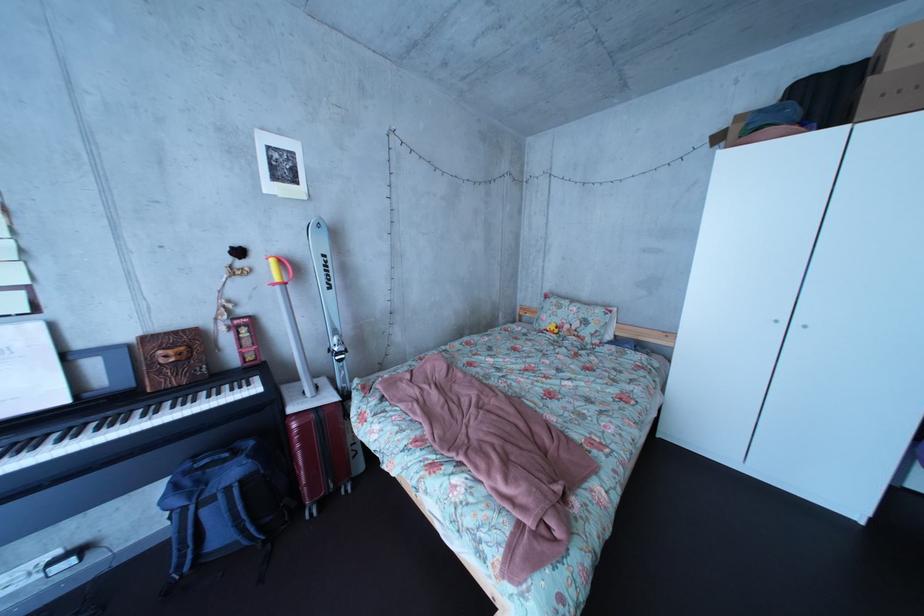
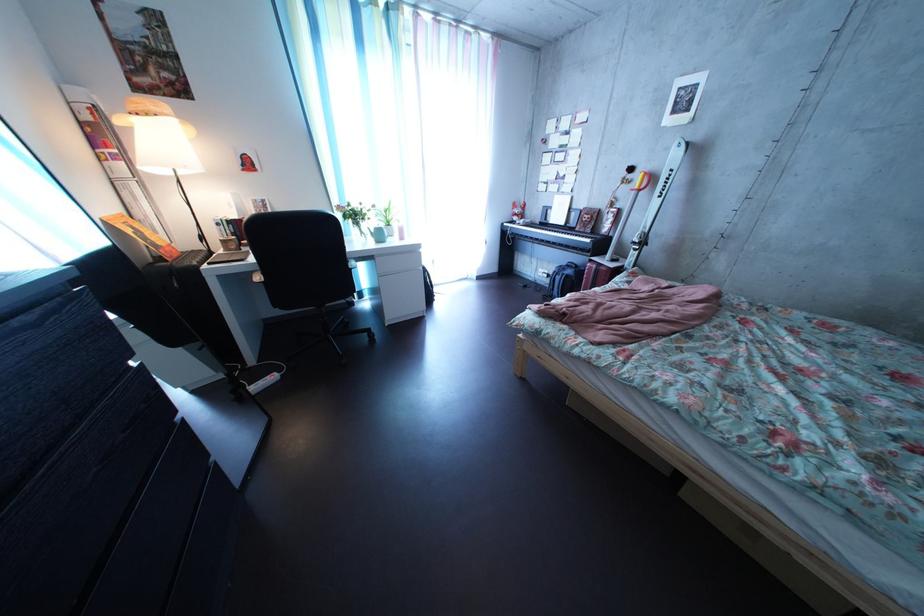
Find the pixel in the second image that matches pixel 80 408 in the first image.

(577, 232)